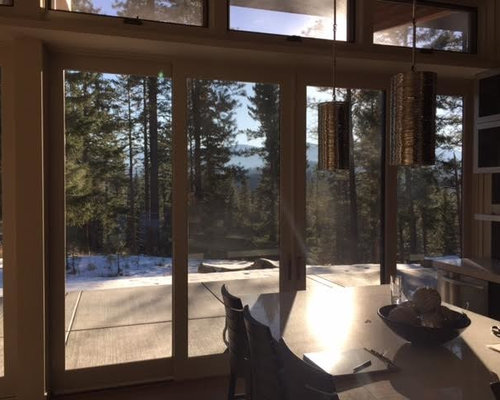
Locate an element on the screen. This screenshot has height=400, width=500. glass is located at coordinates (398, 287).